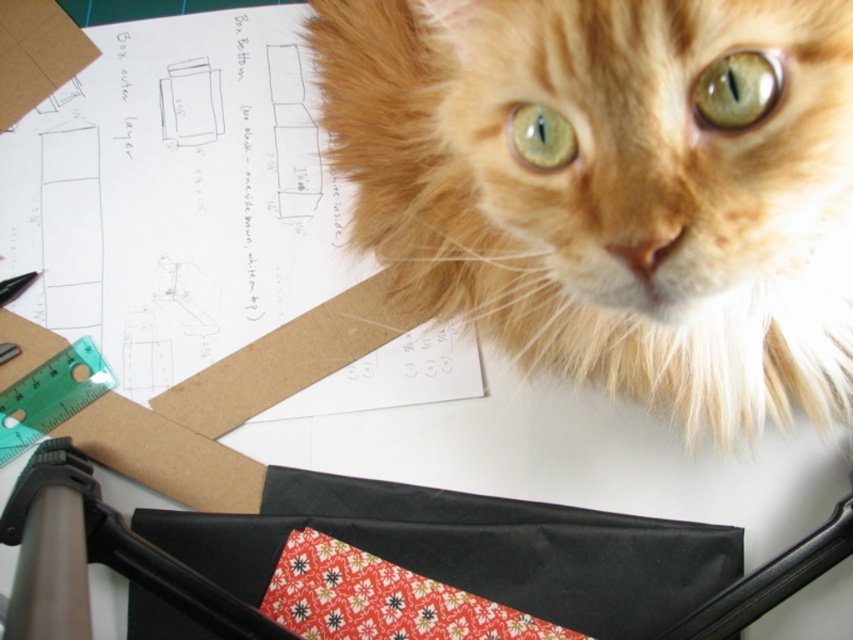
Who is more forward, (x=495, y=113) or (x=90, y=321)?

Point (x=495, y=113)

Which of these two, orange fur cat at upper center or brown cardboard paper at upper left, stands shorter?

orange fur cat at upper center

What do you see at coordinates (613, 186) in the screenshot?
I see `orange fur cat at upper center` at bounding box center [613, 186].

At what (x,y) coordinates should I click in order to perform the action: click on orange fur cat at upper center. Please return your answer as a coordinate pair (x, y). The height and width of the screenshot is (640, 853). Looking at the image, I should click on (613, 186).